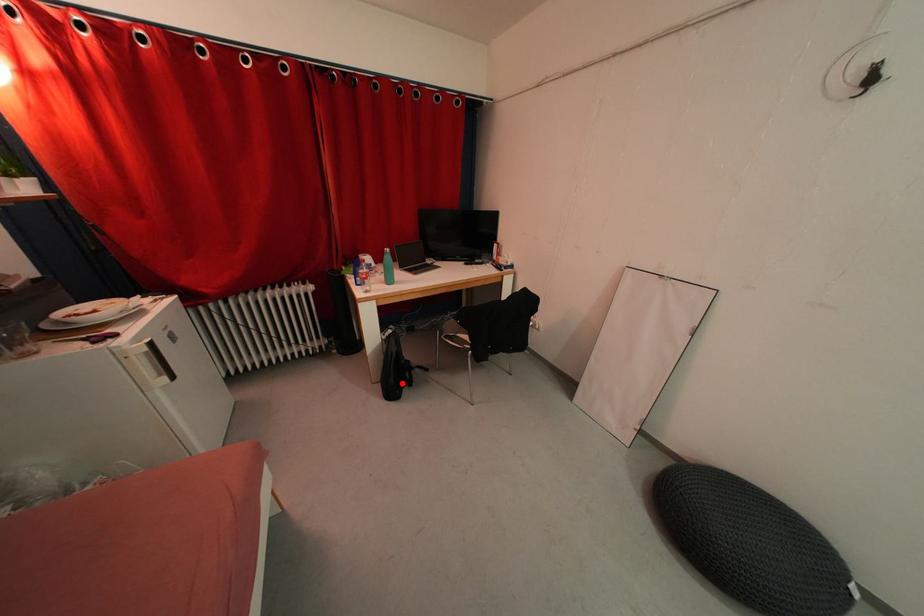
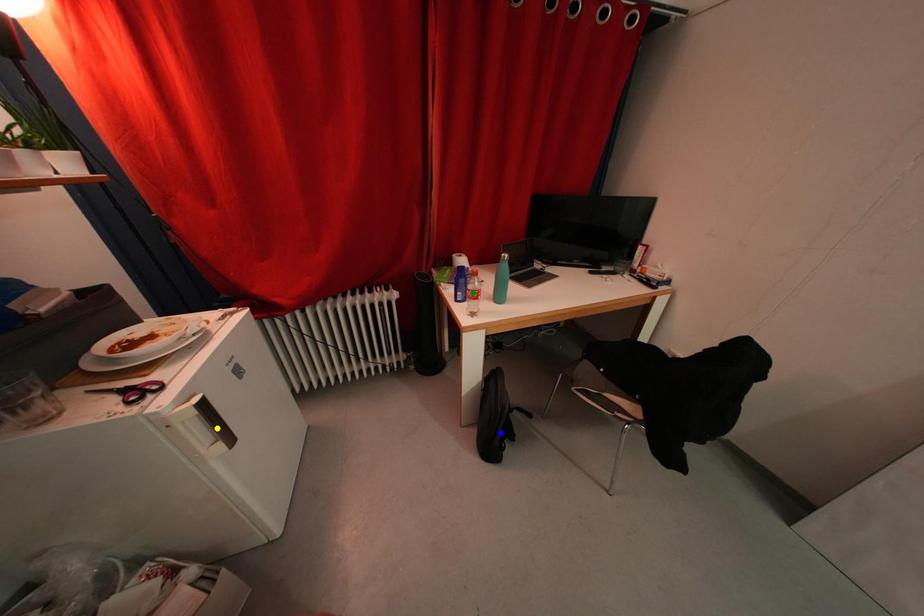
Question: I am providing you with two images of the same scene from different viewpoints. A red point is marked on the first image. You are given multiple points on the second image. Which spot in image 2 lines up with the point in image 1?

Choices:
 (A) yellow point
 (B) blue point
 (C) green point

Answer: (B)